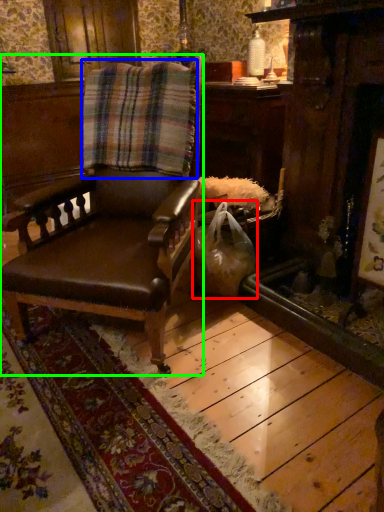
Question: Which is farther away from shopping bag (highlighted by a red box)? blanket (highlighted by a blue box) or chair (highlighted by a green box)?

Choices:
 (A) blanket
 (B) chair

Answer: (A)